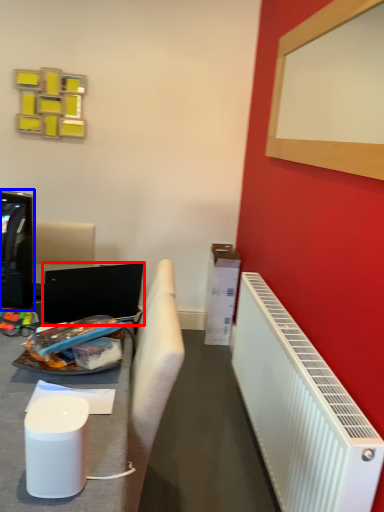
Question: Among these objects, which one is nearest to the camera, laptop (highlighted by a red box) or television (highlighted by a blue box)?

Choices:
 (A) laptop
 (B) television

Answer: (B)